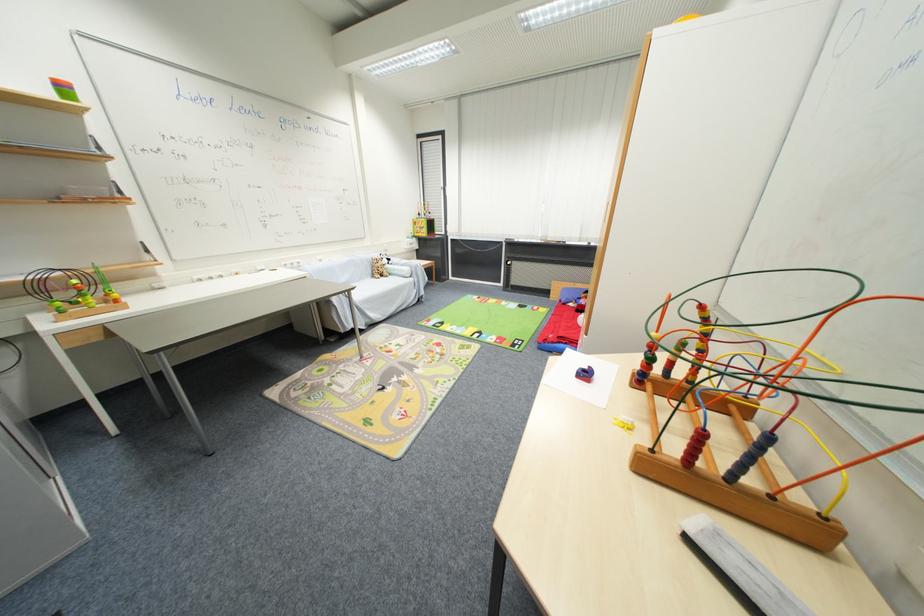
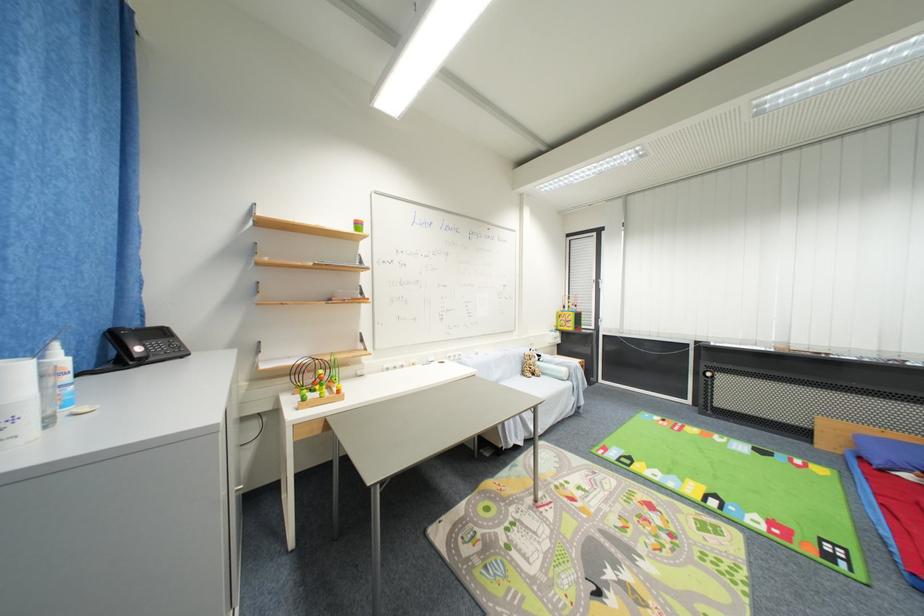
The first image is from the beginning of the video and the second image is from the end. How did the camera likely rotate when shooting the video?

The camera rotated toward left-up.